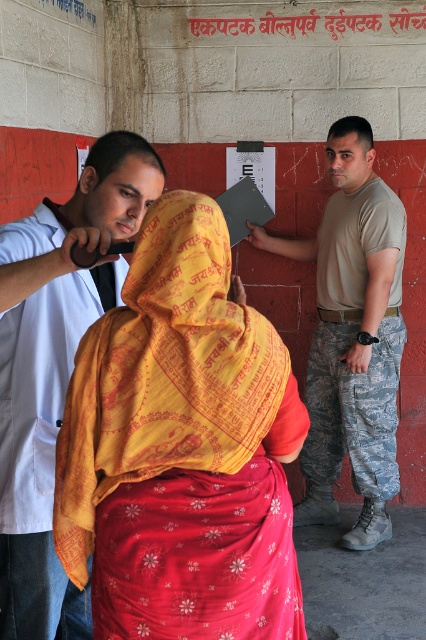
In the scene shown: You are an interior designer planning to add more furniture to the room. The yellow printed fabric at center and the white lab coat at left are currently in the way. Which object should you move first to free up more space for new furniture?

The yellow printed fabric at center should be moved first because it occupies less space than the white lab coat at left, making it easier to clear more area for new furniture.